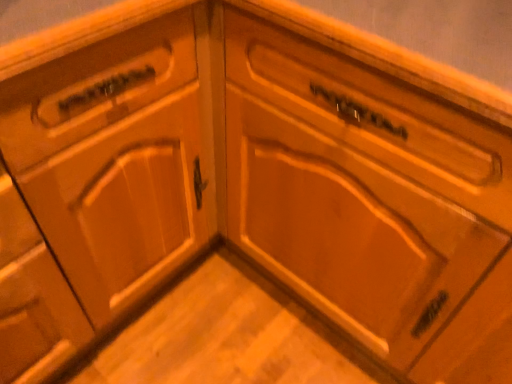
Question: Should I look upward or downward to see wooden drawer at center?

Choices:
 (A) down
 (B) up

Answer: (B)